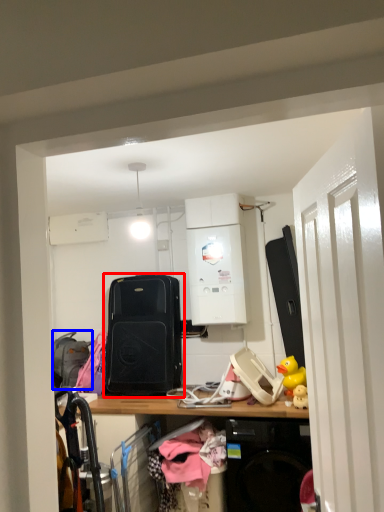
Question: Which object appears farthest to the camera in this image, luggage and bags (highlighted by a red box) or luggage (highlighted by a blue box)?

Choices:
 (A) luggage and bags
 (B) luggage

Answer: (B)